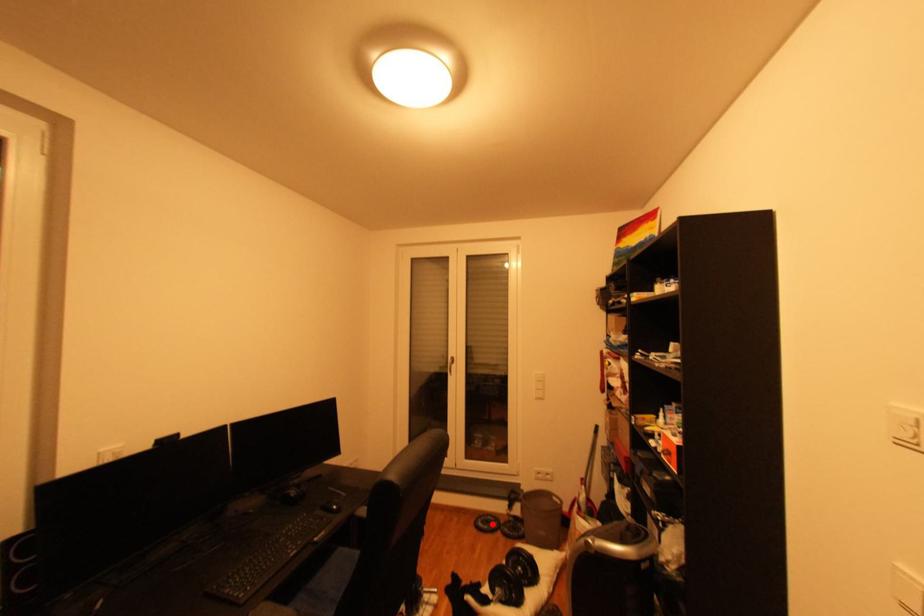
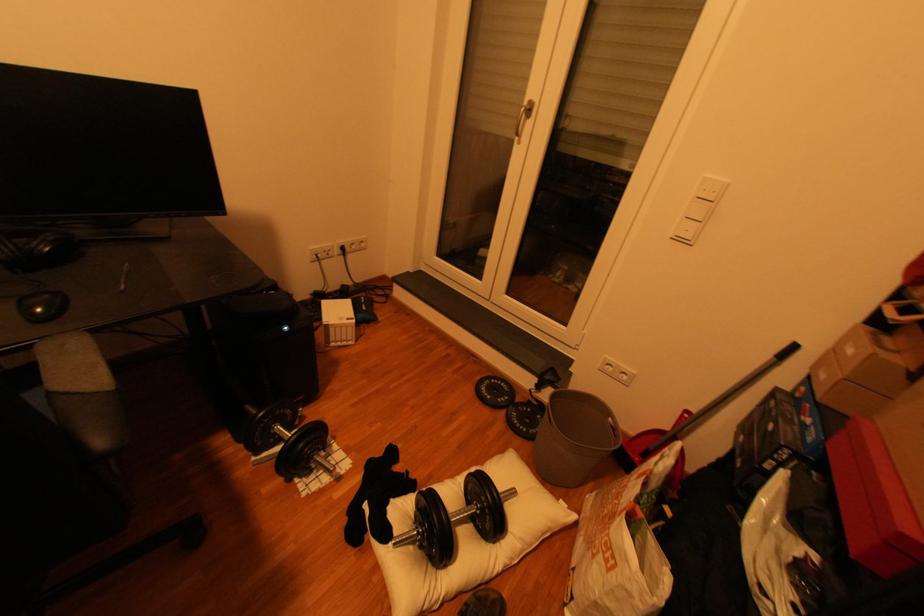
Question: I am providing you with two images of the same scene from different viewpoints. A red point is marked on the first image. At the location where the point appears in image 1, is it still visible in image 2?

Choices:
 (A) Yes
 (B) No

Answer: (A)